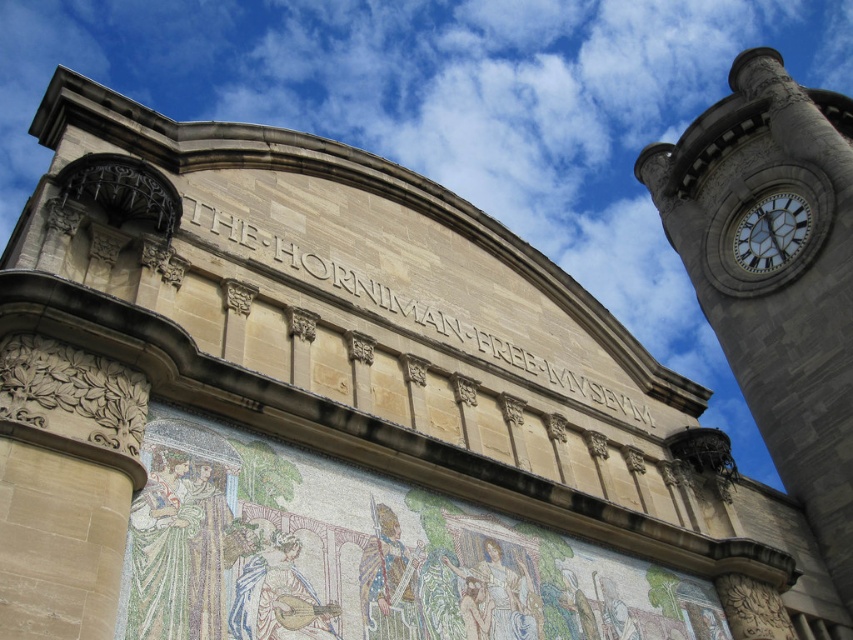
From the picture: Who is positioned more to the right, mosaic artwork at center or stone clock tower at upper right?

Positioned to the right is stone clock tower at upper right.

Between mosaic artwork at center and stone clock tower at upper right, which one is positioned lower?

mosaic artwork at center

Who is more distant from viewer, (548, 563) or (752, 314)?

Positioned behind is point (752, 314).

Image resolution: width=853 pixels, height=640 pixels. In order to click on mosaic artwork at center in this screenshot , I will do `click(364, 556)`.

Which of these two, mosaic artwork at center or white glossy clock at upper right, stands shorter?

Standing shorter between the two is white glossy clock at upper right.

Is point (415, 632) behind point (746, 266)?

That is False.

Locate an element on the screen. The image size is (853, 640). mosaic artwork at center is located at coordinates (364, 556).

From the picture: Is stone clock tower at upper right shorter than white glossy clock at upper right?

No, stone clock tower at upper right is not shorter than white glossy clock at upper right.

Between stone clock tower at upper right and white glossy clock at upper right, which one has less height?

Standing shorter between the two is white glossy clock at upper right.

The width and height of the screenshot is (853, 640). I want to click on stone clock tower at upper right, so click(x=775, y=273).

The height and width of the screenshot is (640, 853). What are the coordinates of `stone clock tower at upper right` in the screenshot? It's located at (775, 273).